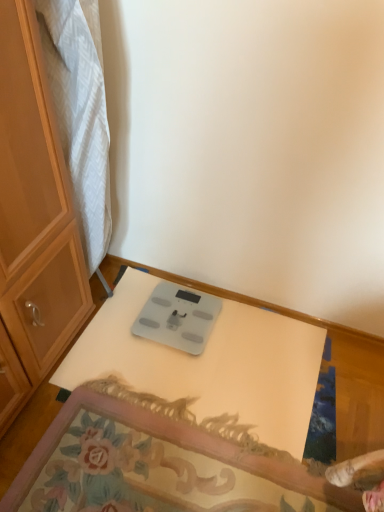
Find the location of a particular element. vacant space to the left of silver metallic scale at center is located at coordinates (123, 322).